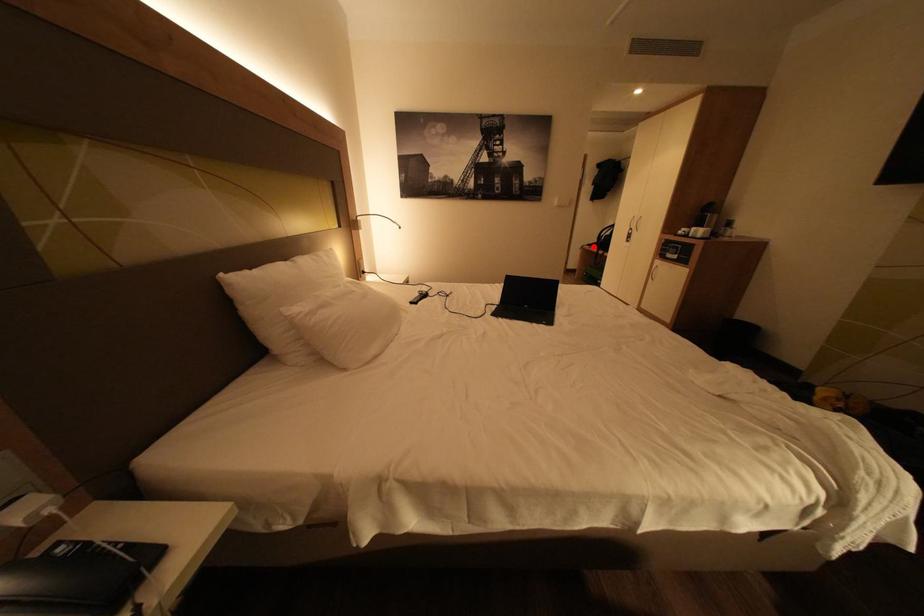
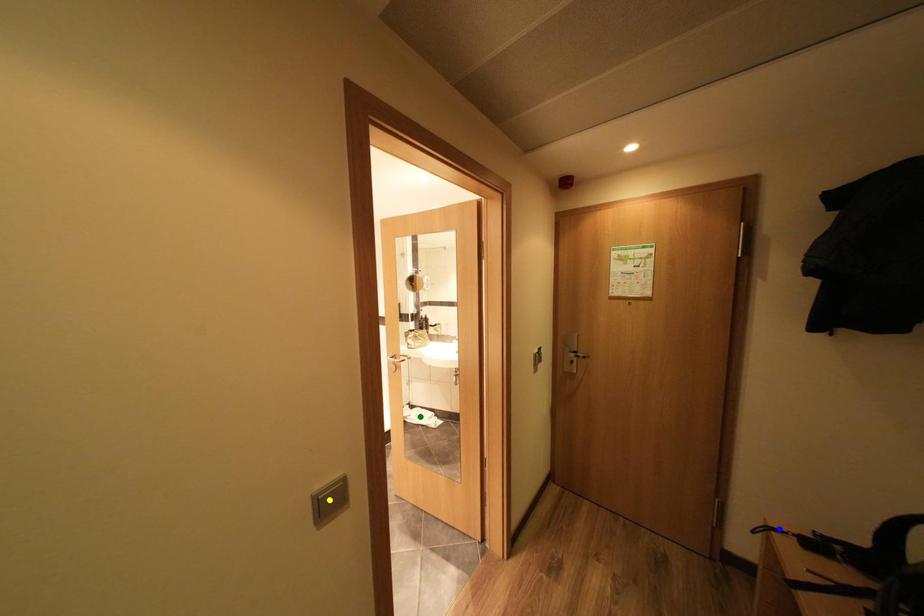
Question: I am providing you with two images of the same scene from different viewpoints. A red point is marked on the first image. You are given multiple points on the second image. Which point in image 2 is actually the same real-world point as the red point in image 1?

Choices:
 (A) green point
 (B) blue point
 (C) yellow point

Answer: (B)